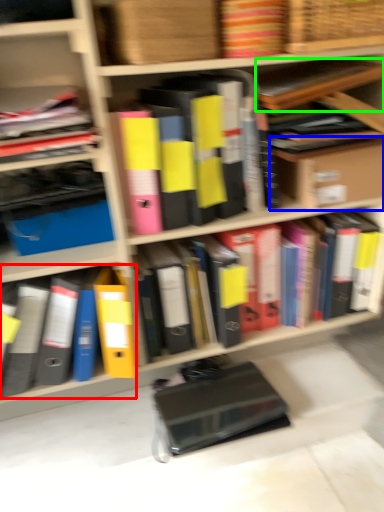
Question: Considering the real-world distances, which object is closest to book (highlighted by a red box)? cardboard box (highlighted by a blue box) or book (highlighted by a green box).

Choices:
 (A) cardboard box
 (B) book

Answer: (A)